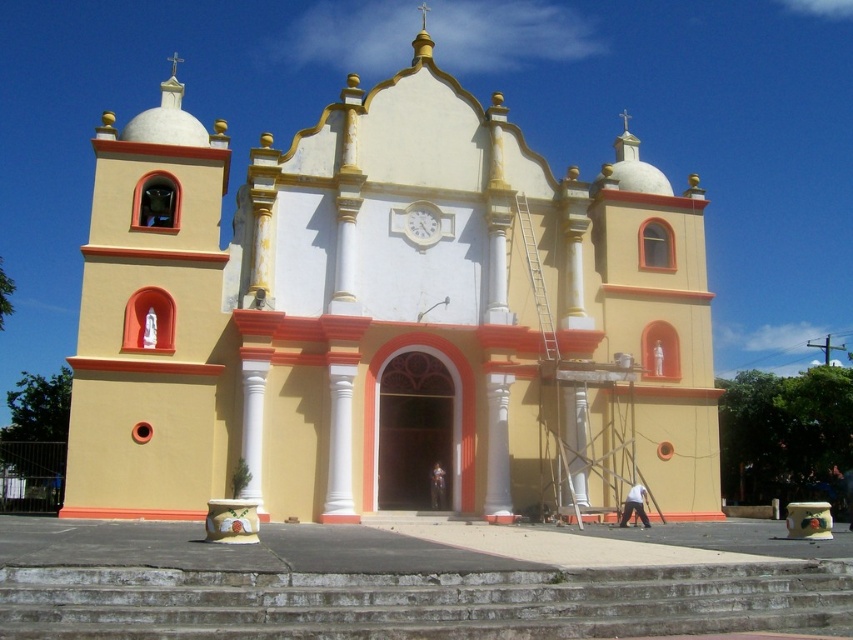
Does yellow matte church at center appear under concrete stairs at center?

Incorrect, yellow matte church at center is not positioned below concrete stairs at center.

Can you confirm if yellow matte church at center is bigger than concrete stairs at center?

Yes, yellow matte church at center is bigger than concrete stairs at center.

Between point (502, 376) and point (216, 616), which one is positioned behind?

The point (502, 376) is behind.

Identify the location of yellow matte church at center. The height and width of the screenshot is (640, 853). (387, 317).